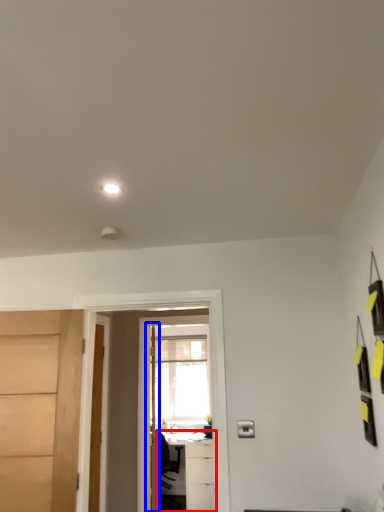
Question: Among these objects, which one is farthest to the camera, table (highlighted by a red box) or door (highlighted by a blue box)?

Choices:
 (A) table
 (B) door

Answer: (A)